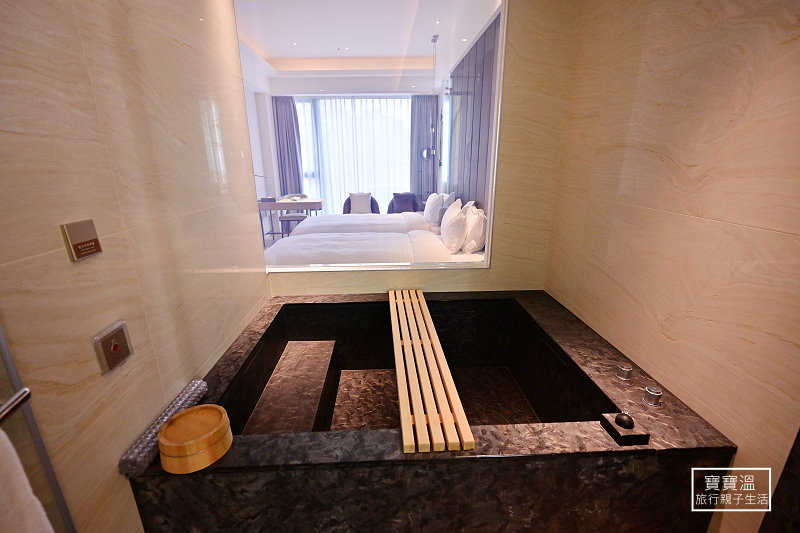
You are a GUI agent. You are given a task and a screenshot of the screen. Output one action in this format:
    pyautogui.click(x=<x>, y=<y>)
    Task: Click on the silver towel bar
    The height and width of the screenshot is (533, 800).
    Given the screenshot: What is the action you would take?
    pyautogui.click(x=21, y=399)